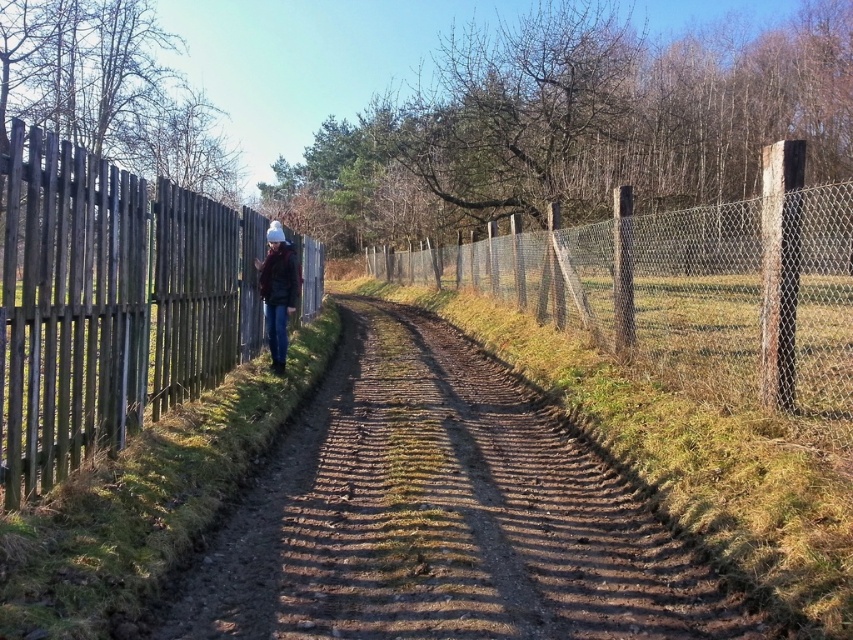
Question: Is wooden planks at left below matte black jacket at center?

Choices:
 (A) yes
 (B) no

Answer: (A)

Question: Which point is closer to the camera?

Choices:
 (A) (750, 403)
 (B) (370, 490)
 (C) (270, 236)
 (D) (10, 300)

Answer: (D)

Question: Observing the image, what is the correct spatial positioning of wooden planks at left in reference to wire mesh fence at center?

Choices:
 (A) left
 (B) right

Answer: (A)

Question: Which object is positioned farthest from the wire mesh fence at center?

Choices:
 (A) matte black jacket at center
 (B) wooden planks at left

Answer: (A)

Question: Can you confirm if brown textured dirt track at center is positioned to the right of wooden planks at left?

Choices:
 (A) yes
 (B) no

Answer: (A)

Question: Estimate the real-world distances between objects in this image. Which object is closer to the matte black jacket at center?

Choices:
 (A) wooden planks at left
 (B) brown textured dirt track at center
 (C) wire mesh fence at center

Answer: (A)